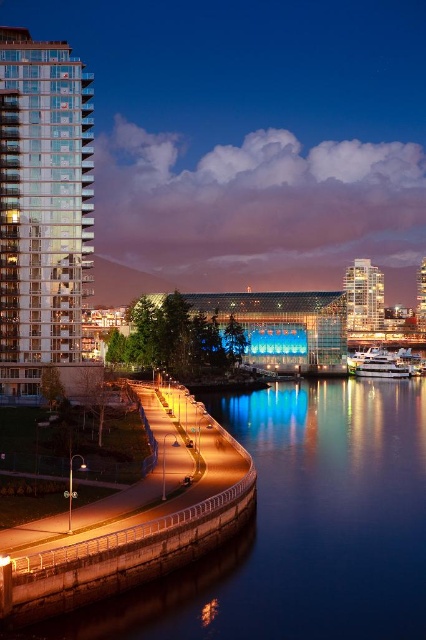
At what (x,y) coordinates should I click in order to perform the action: click on transparent glass building at left. Please return your answer as a coordinate pair (x, y). The image size is (426, 640). Looking at the image, I should click on (43, 212).

How far apart are transparent glass building at left and white glossy yacht at lower right?

A distance of 71.29 meters exists between transparent glass building at left and white glossy yacht at lower right.

Image resolution: width=426 pixels, height=640 pixels. What are the coordinates of `transparent glass building at left` in the screenshot? It's located at click(x=43, y=212).

Is blue glassy river at lower center above matte glass building at upper right?

No, blue glassy river at lower center is not above matte glass building at upper right.

The width and height of the screenshot is (426, 640). What are the coordinates of `blue glassy river at lower center` in the screenshot? It's located at [302, 525].

Image resolution: width=426 pixels, height=640 pixels. Find the location of `blue glassy river at lower center`. blue glassy river at lower center is located at coordinates (302, 525).

From the picture: Can you confirm if blue glassy river at lower center is thinner than transparent glass building at left?

In fact, blue glassy river at lower center might be wider than transparent glass building at left.

Can you confirm if blue glassy river at lower center is positioned below transparent glass building at left?

Correct, blue glassy river at lower center is located below transparent glass building at left.

Does point (391, 556) come farther from viewer compared to point (3, 368)?

No, (391, 556) is in front of (3, 368).

This screenshot has width=426, height=640. What are the coordinates of `blue glassy river at lower center` in the screenshot? It's located at (302, 525).